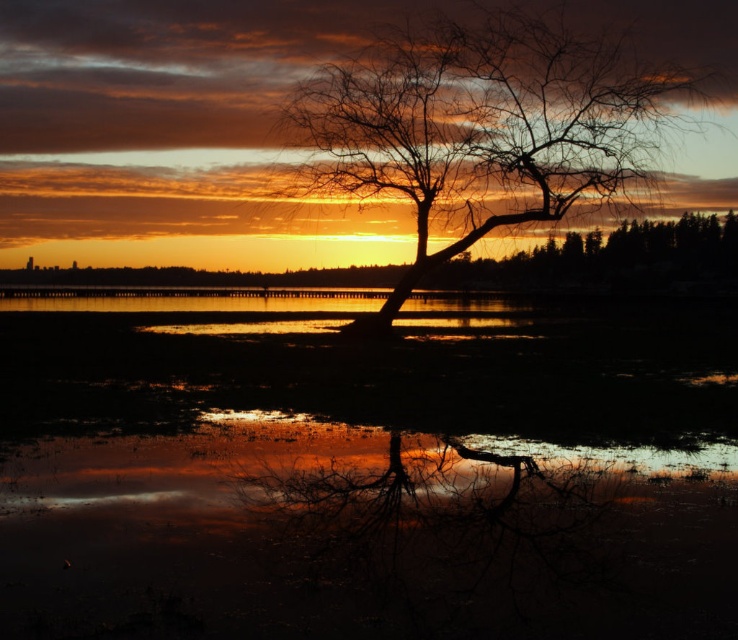
Is translucent reflective water at center shorter than silhouette bark tree at center?

Yes.

Is translucent reflective water at center above silhouette bark tree at center?

No, translucent reflective water at center is not above silhouette bark tree at center.

You are a GUI agent. You are given a task and a screenshot of the screen. Output one action in this format:
    pyautogui.click(x=<x>, y=<y>)
    Task: Click on the translucent reflective water at center
    
    Given the screenshot: What is the action you would take?
    pyautogui.click(x=365, y=468)

At what (x,y) coordinates should I click in order to perform the action: click on translucent reflective water at center. Please return your answer as a coordinate pair (x, y). Looking at the image, I should click on click(x=365, y=468).